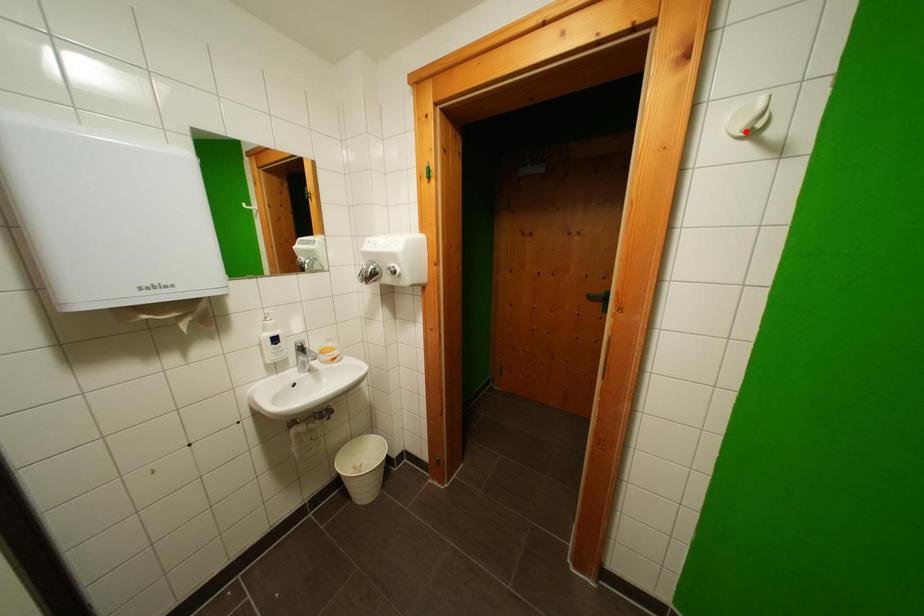
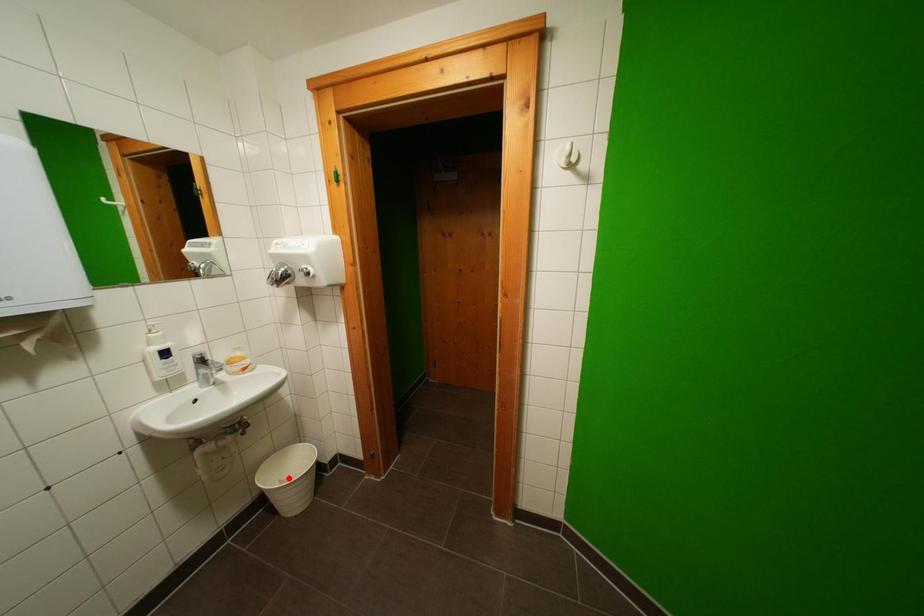
I am providing you with two images of the same scene from different viewpoints. A red point is marked on the first image and another point is marked on the second image. Do the highlighted points in image1 and image2 indicate the same real-world spot?

No